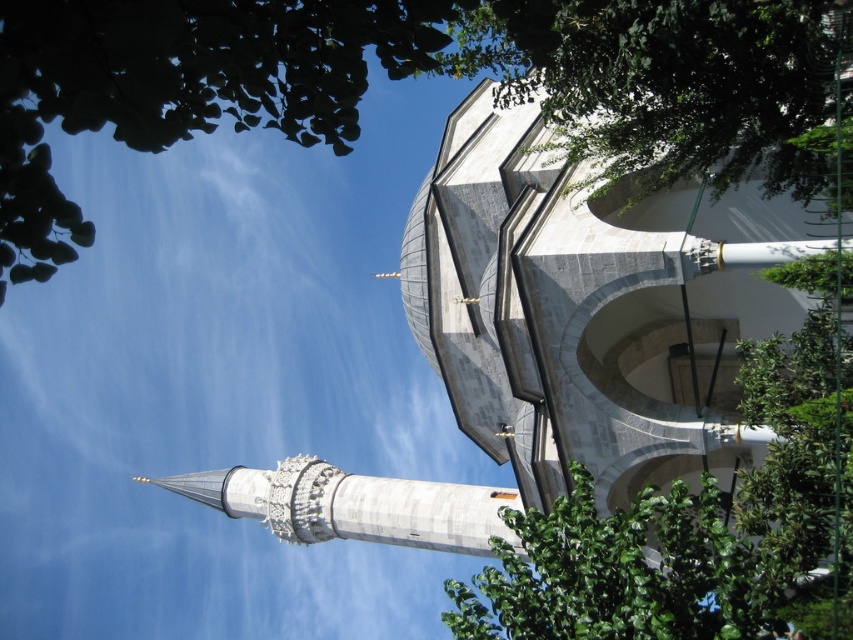
Who is more forward, (12,116) or (640,561)?

Point (12,116) is more forward.

Does green leafy tree at upper left come behind green leafy tree at upper center?

No.

At what (x,y) coordinates should I click in order to perform the action: click on green leafy tree at upper left. Please return your answer as a coordinate pair (x, y). Looking at the image, I should click on (386, 74).